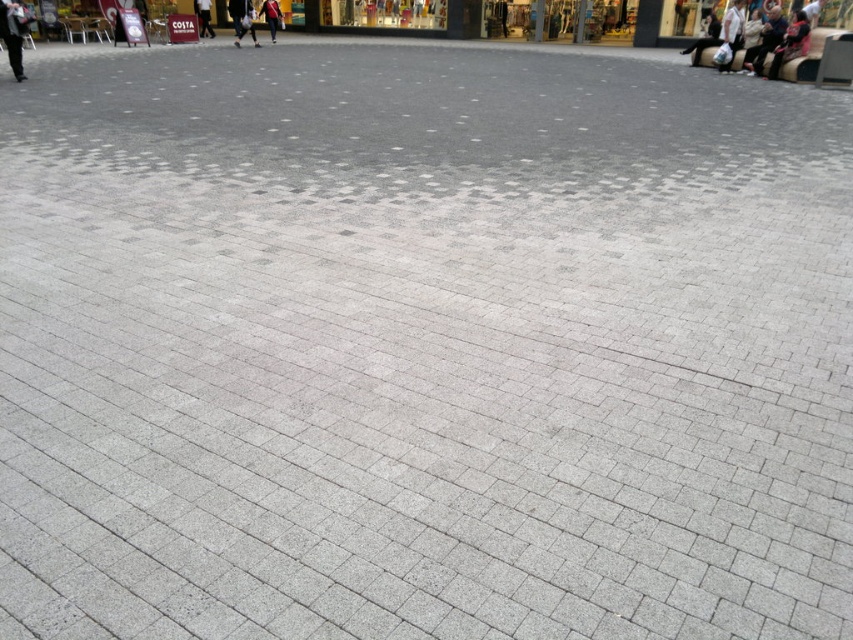
Does dark blue jeans at upper right have a larger size compared to dark gray fabric jacket at center?

Yes, dark blue jeans at upper right is bigger than dark gray fabric jacket at center.

Based on the photo, who is more distant from viewer, (802,51) or (235,3)?

Point (235,3)

You are a GUI agent. You are given a task and a screenshot of the screen. Output one action in this format:
    pyautogui.click(x=<x>, y=<y>)
    Task: Click on the dark blue jeans at upper right
    
    Given the screenshot: What is the action you would take?
    pyautogui.click(x=746, y=38)

Where is `dark gray fabric jacket at center`? This screenshot has height=640, width=853. dark gray fabric jacket at center is located at coordinates (242, 19).

Is dark gray fabric jacket at center bigger than light blue jeans at center?

Incorrect, dark gray fabric jacket at center is not larger than light blue jeans at center.

Is point (241, 0) less distant than point (276, 33)?

Yes, it is.

At what (x,y) coordinates should I click in order to perform the action: click on dark gray fabric jacket at center. Please return your answer as a coordinate pair (x, y). This screenshot has width=853, height=640. Looking at the image, I should click on (242, 19).

Where is `dark gray pants at left`? The height and width of the screenshot is (640, 853). dark gray pants at left is located at coordinates (13, 33).

Does dark gray pants at left appear under light blue jeans at center?

Indeed, dark gray pants at left is positioned under light blue jeans at center.

What do you see at coordinates (13, 33) in the screenshot?
I see `dark gray pants at left` at bounding box center [13, 33].

I want to click on dark gray pants at left, so click(x=13, y=33).